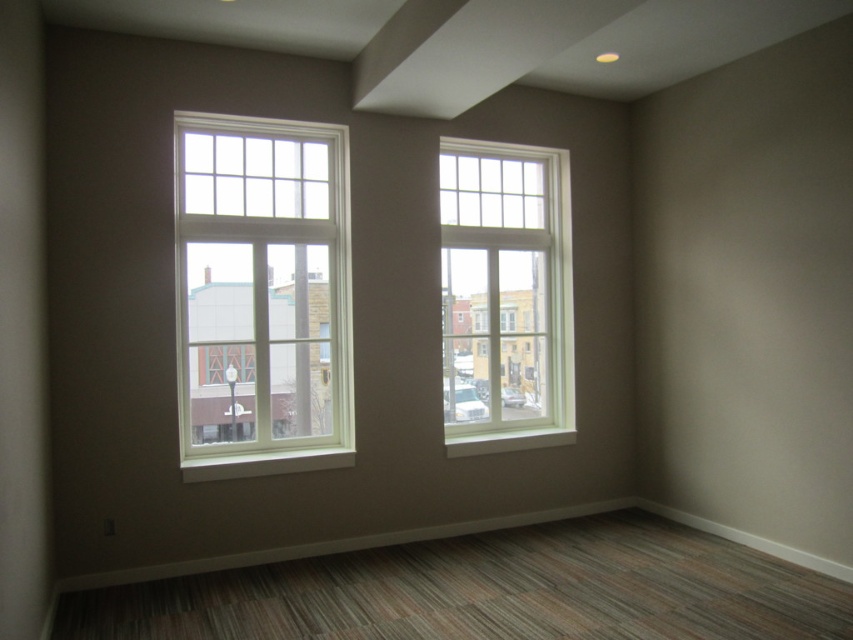
You are an interior designer assessing the room layout. You need to place a large potted plant between the white wood window at left and the white wood window at center. Given their widths, which window should the plant be closer to and why?

The plant should be closer to the white wood window at left because its width is larger than the white wood window at center, providing more space for the plant to fit comfortably.

You are standing in the room described in the scene. There is a point labeled at coordinates (262, 296). What object is located at that point?

The point at coordinates (262, 296) indicates the white wood window at left.

Looking at this image, what are the coordinates of the white wood window at left?

The white wood window at left is located at coordinates point [262,296].